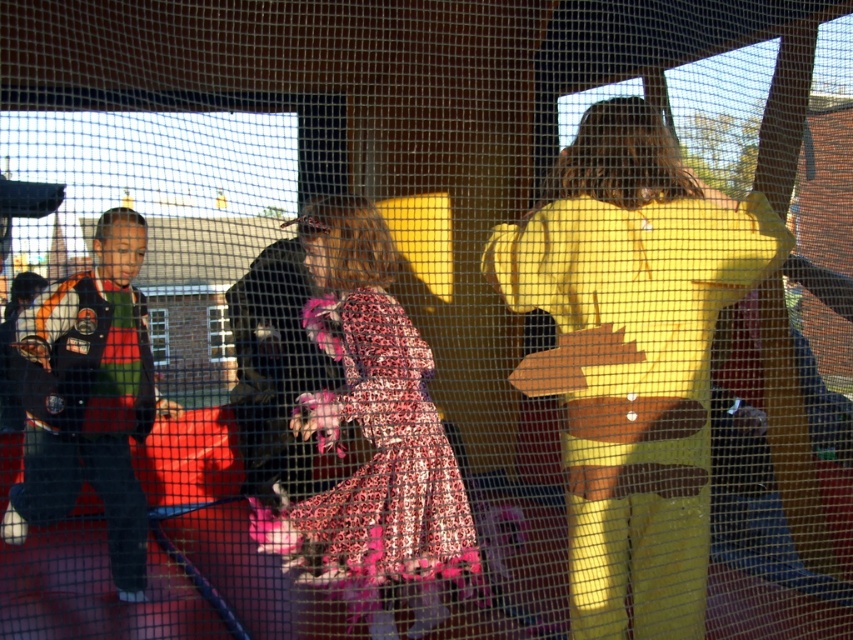
Where is `leopard print dress at center`? The image size is (853, 640). leopard print dress at center is located at coordinates (372, 436).

Does point (419, 500) lie in front of point (91, 280)?

Yes, it is in front of point (91, 280).

I want to click on leopard print dress at center, so click(372, 436).